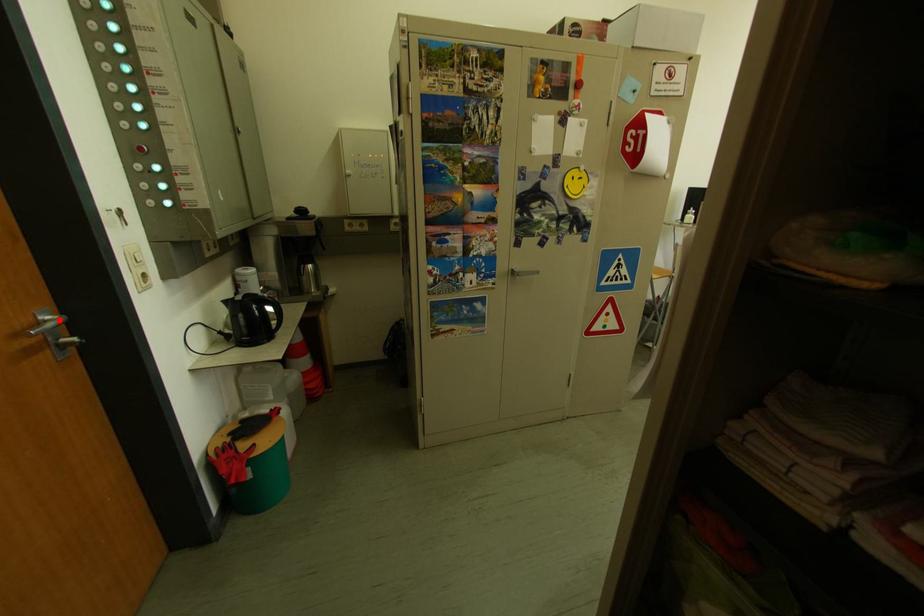
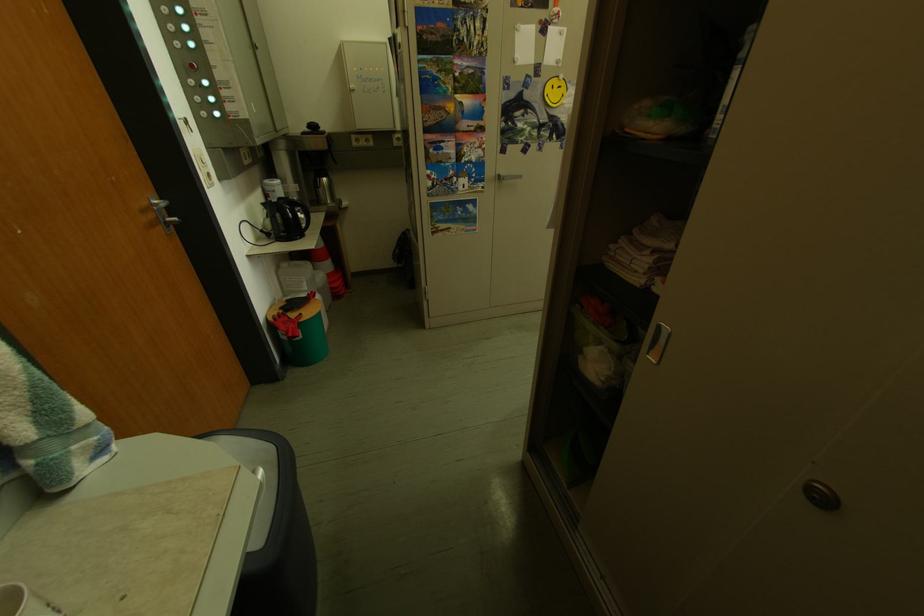
Where in the second image is the point corresponding to the highlighted location from the first image?

(168, 205)